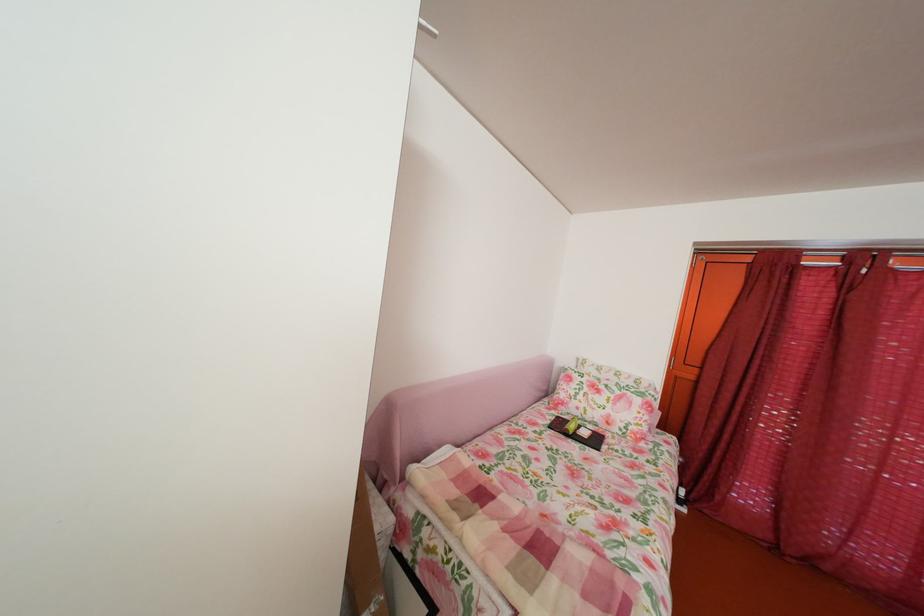
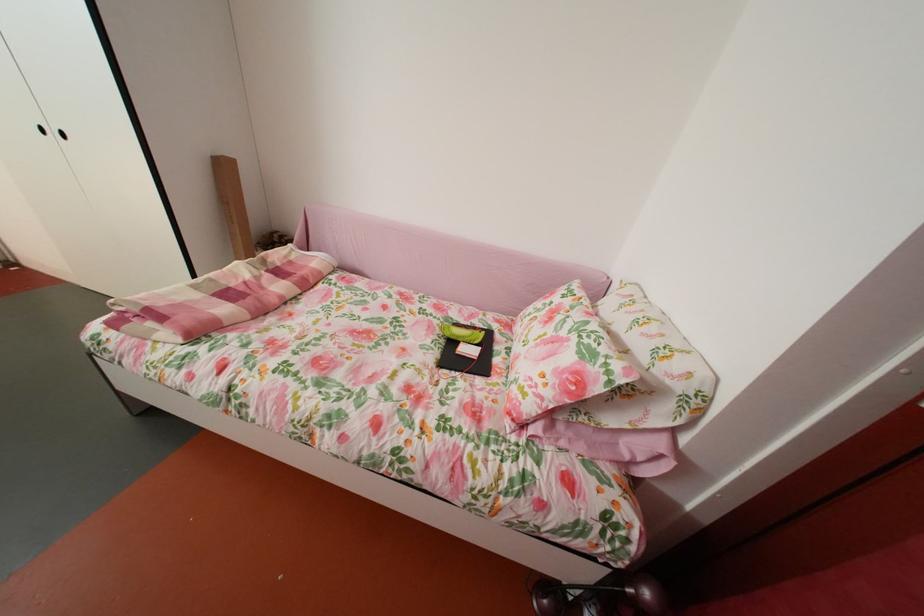
In the second image, find the point that corresponds to pixel 561 429 in the first image.

(473, 328)